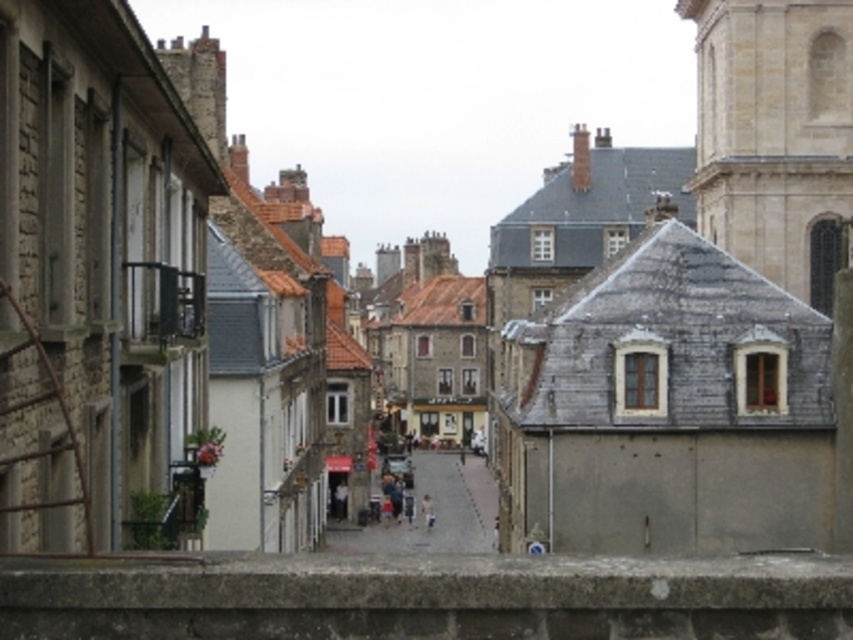
Does concrete ledge at lower center have a larger size compared to beige stone tower at upper right?

No, concrete ledge at lower center is not bigger than beige stone tower at upper right.

Is concrete ledge at lower center to the left of beige stone tower at upper right from the viewer's perspective?

Yes, concrete ledge at lower center is to the left of beige stone tower at upper right.

Is point (682, 560) in front of point (747, 170)?

Yes.

This screenshot has height=640, width=853. I want to click on concrete ledge at lower center, so 431,596.

Can you confirm if concrete ledge at lower center is wider than smooth stone alley at center?

Yes, concrete ledge at lower center is wider than smooth stone alley at center.

Looking at this image, measure the distance from concrete ledge at lower center to smooth stone alley at center.

The distance of concrete ledge at lower center from smooth stone alley at center is 398.33 feet.

The height and width of the screenshot is (640, 853). What do you see at coordinates (431, 596) in the screenshot?
I see `concrete ledge at lower center` at bounding box center [431, 596].

Image resolution: width=853 pixels, height=640 pixels. In order to click on concrete ledge at lower center in this screenshot , I will do `click(431, 596)`.

Which of these two, beige stone tower at upper right or smooth stone alley at center, stands taller?

Standing taller between the two is beige stone tower at upper right.

From the picture: Measure the distance between beige stone tower at upper right and smooth stone alley at center.

35.85 meters

At what (x,y) coordinates should I click in order to perform the action: click on beige stone tower at upper right. Please return your answer as a coordinate pair (x, y). This screenshot has width=853, height=640. Looking at the image, I should click on (775, 136).

Identify the location of beige stone tower at upper right. The height and width of the screenshot is (640, 853). (775, 136).